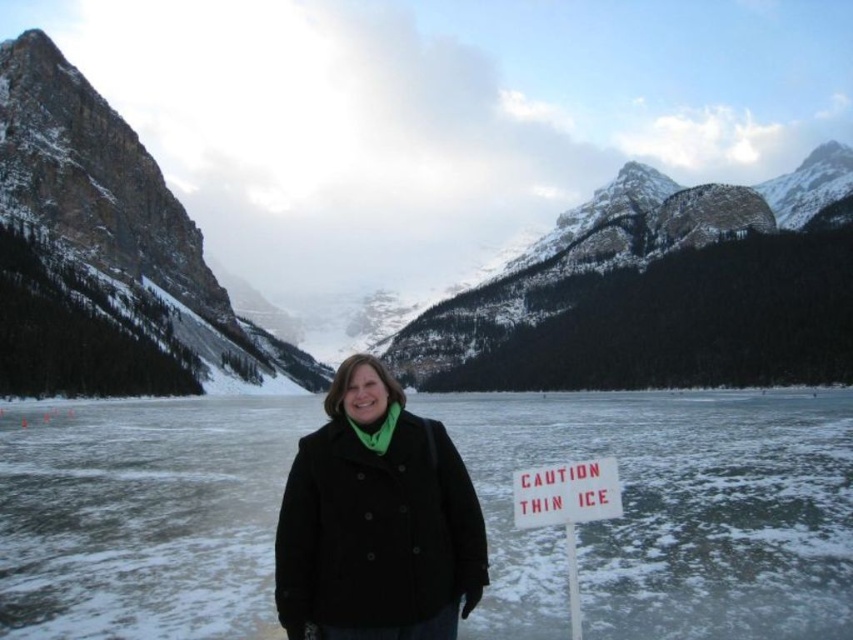
You are a drone operator tasked with capturing aerial footage of the frozen lake. The camera is currently positioned above the white ice at center. To ensure safety, you need to move the camera to a location that is 0.1 units higher in the y coordinate and 0.1 units to the right in the x coordinate. What will be the new coordinates of the camera after this adjustment?

The new coordinates will be x 0.902 and y 0.885.

You are a hiker who just arrived at the frozen lake. You see the black wool coat at center and the white plastic sign at lower right. Which object is closer to the right side of the image?

The white plastic sign at lower right is closer to the right side of the image because the black wool coat at center is to the left of it.

You are a photographer trying to capture the scene with the black wool coat at center and the white plastic sign at lower right. Since you want to ensure both objects are in focus, you need to know their relative sizes. Which object is taller?

The black wool coat at center is taller than the white plastic sign at lower right.